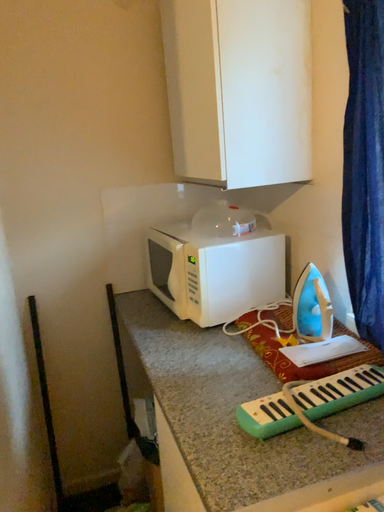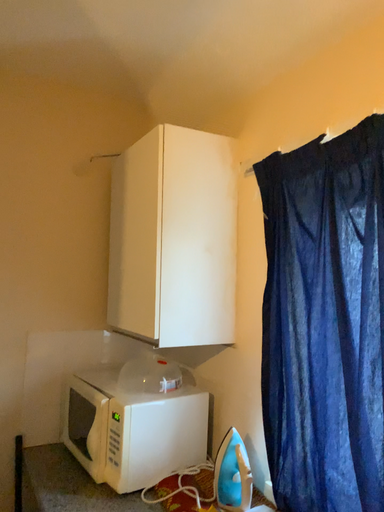
Question: Which way did the camera rotate in the video?

Choices:
 (A) rotated downward
 (B) rotated upward

Answer: (B)